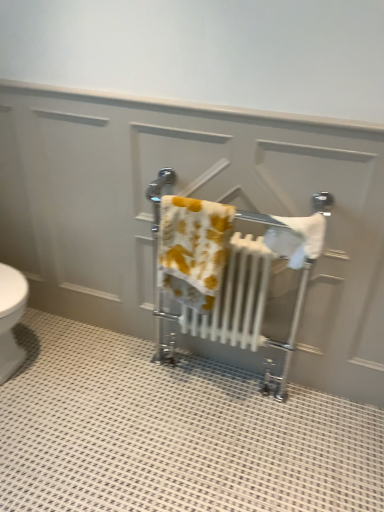
Question: Is yellow printed towel at center, the 1th bath towel positioned from the left, wider or thinner than white cotton towel at center, which is counted as the 1th bath towel, starting from the right?

Choices:
 (A) wide
 (B) thin

Answer: (B)

Question: In terms of size, does yellow printed towel at center, the 1th bath towel positioned from the left, appear bigger or smaller than white cotton towel at center, which is counted as the 1th bath towel, starting from the right?

Choices:
 (A) big
 (B) small

Answer: (A)

Question: Which is farther from the white cotton towel at center, the second bath towel viewed from the left?

Choices:
 (A) white metallic towel rack at center
 (B) yellow printed towel at center, the 1th bath towel positioned from the left

Answer: (B)

Question: Estimate the real-world distances between objects in this image. Which object is closer to the white metallic towel rack at center?

Choices:
 (A) white cotton towel at center, the second bath towel viewed from the left
 (B) yellow printed towel at center, marked as the 2th bath towel in a right-to-left arrangement

Answer: (A)